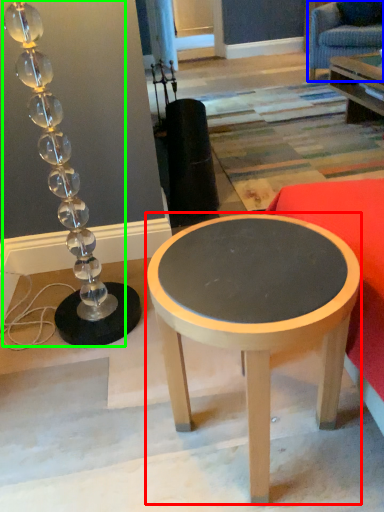
Question: Which object is the closest to the coffee table (highlighted by a red box)? Choose among these: swivel chair (highlighted by a blue box) or lamp (highlighted by a green box).

Choices:
 (A) swivel chair
 (B) lamp

Answer: (B)